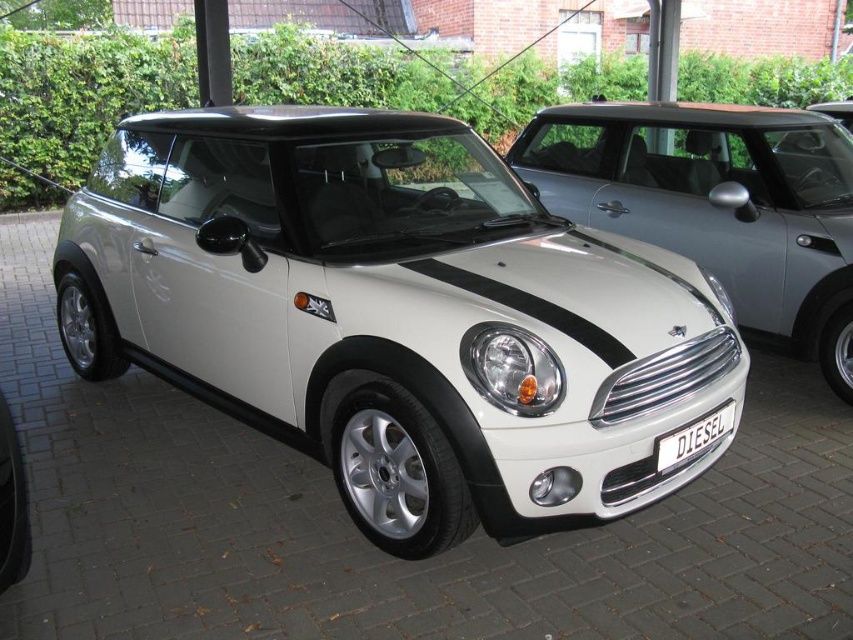
You are a photographer standing in front of the white matte car at center and the black metallic license plate at center. You want to take a photo that includes both objects. Which object should you position closer to the camera to ensure both are in focus?

The white matte car at center is further to the viewer than the black metallic license plate at center. To ensure both are in focus, position the camera closer to the white matte car at center since it is already farther away, allowing the license plate to be within the same focal plane.

You are a delivery person who needs to load a package onto a truck. The truck can only accommodate items that are smaller than the white metallic car at center. Is the black metallic license plate at center too big to fit?

The white metallic car at center is larger than the black metallic license plate at center. Since the truck can only take items smaller than the car, the license plate is small enough to fit.

You are a parking attendant and need to guide a customer to their white matte car at center. They mention it has a black metallic license plate at center. Based on the scene, where should they look relative to the license plate to find their car?

The white matte car at center is positioned on the right side of the black metallic license plate at center, so the customer should look to the right of the license plate to find their car.